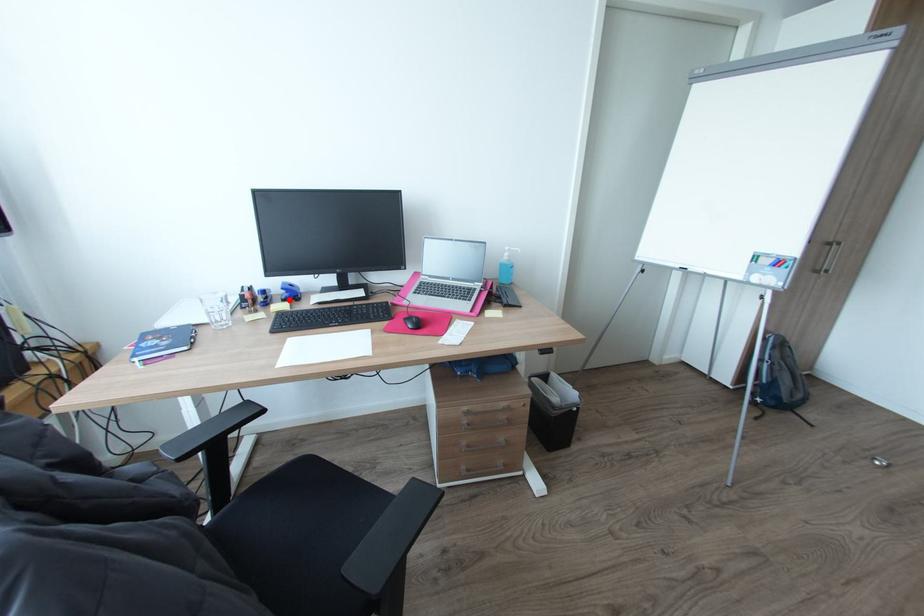
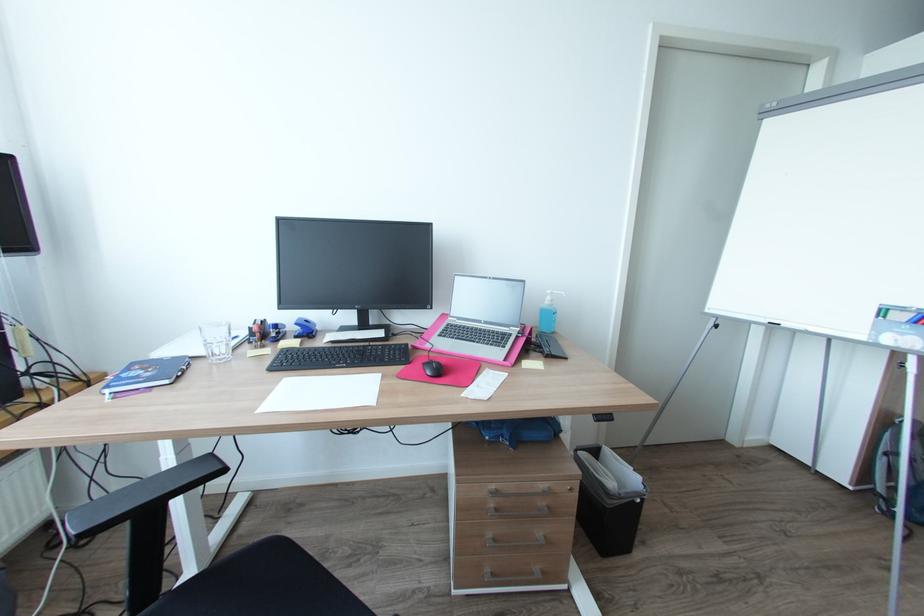
The point at the highlighted location is marked in the first image. Where is the corresponding point in the second image?

(301, 337)